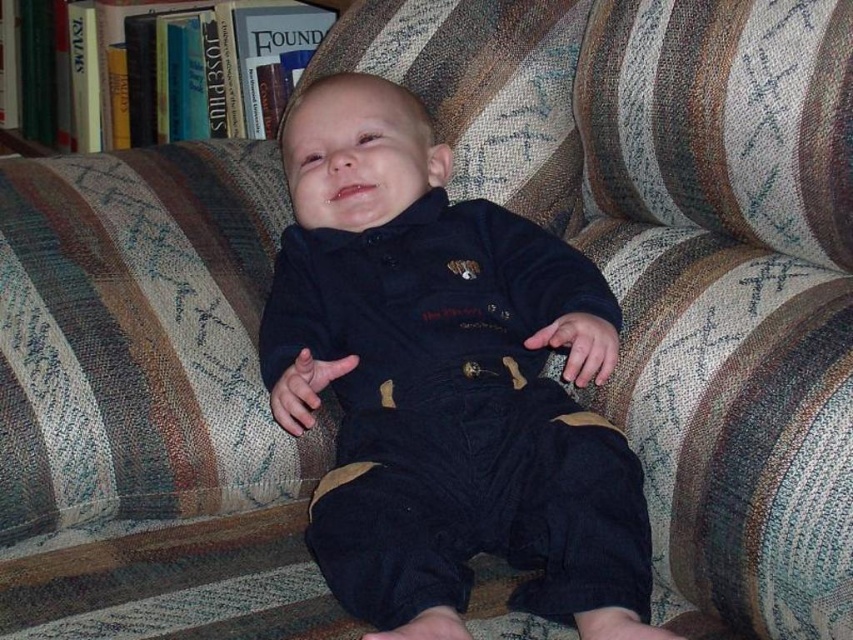
Looking at this image, who is positioned more to the right, velvet dark blue onesie at center or hardcover books at upper left?

Positioned to the right is velvet dark blue onesie at center.

Measure the distance between point (561, 570) and camera.

Point (561, 570) is 32.15 inches away from camera.

Find the location of a particular element. velvet dark blue onesie at center is located at coordinates (445, 384).